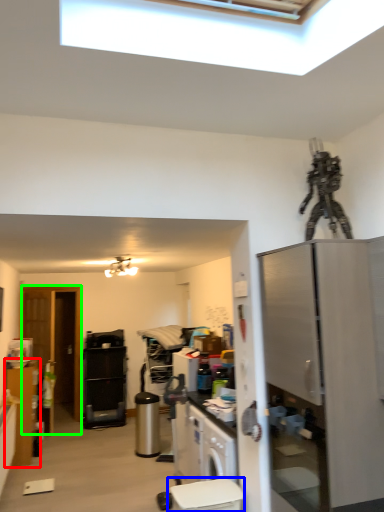
Question: Which object is positioned closest to cabinetry (highlighted by a red box)? Select from toilet bowl (highlighted by a blue box) and glass door (highlighted by a green box).

Choices:
 (A) toilet bowl
 (B) glass door

Answer: (B)